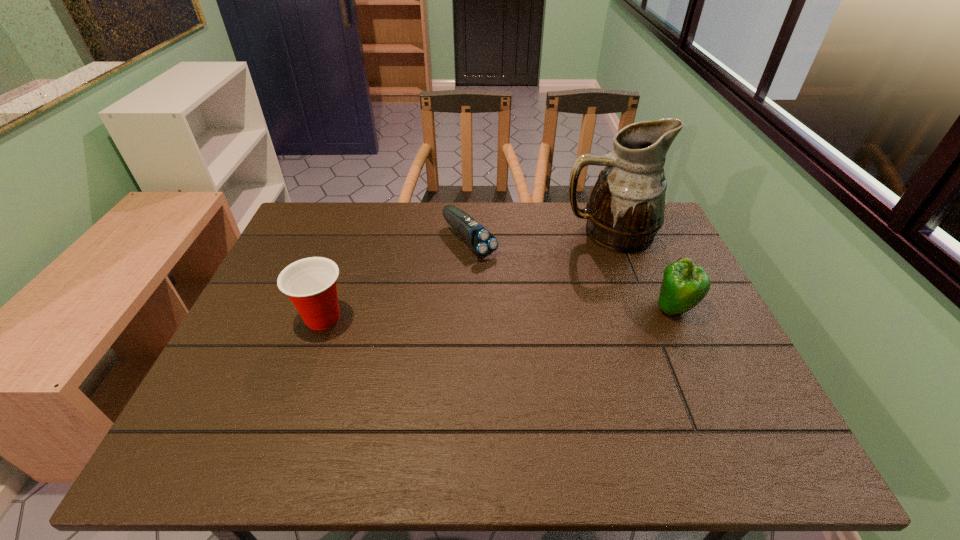
The image size is (960, 540). I want to click on cup, so click(311, 283).

Find the location of `the second shortest object`. the second shortest object is located at coordinates (311, 283).

Identify the location of the second tallest object. This screenshot has width=960, height=540. (685, 285).

You are a GUI agent. You are given a task and a screenshot of the screen. Output one action in this format:
    pyautogui.click(x=<x>, y=<y>)
    Task: Click on the shortest object
    This screenshot has height=540, width=960.
    Given the screenshot: What is the action you would take?
    pyautogui.click(x=481, y=241)

Where is `the third object from right to left`? the third object from right to left is located at coordinates (481, 241).

Locate an element on the screen. The image size is (960, 540). pitcher is located at coordinates (625, 210).

The width and height of the screenshot is (960, 540). I want to click on vacant space located 0.310m on the back of the leftmost object, so click(354, 230).

Identify the location of blank space located on the front of the bell pepper. The height and width of the screenshot is (540, 960). (712, 393).

Find the location of a particular element. The width and height of the screenshot is (960, 540). vacant space positioned on the head of the electric shaver is located at coordinates (546, 314).

Where is `vacant region located on the head of the electric shaver`? vacant region located on the head of the electric shaver is located at coordinates (534, 302).